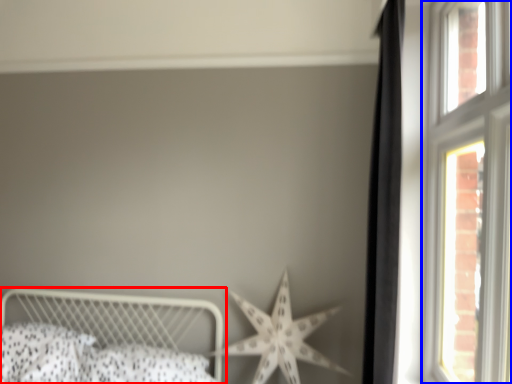
Question: Which object is further to the camera taking this photo, bed (highlighted by a red box) or window (highlighted by a blue box)?

Choices:
 (A) bed
 (B) window

Answer: (A)